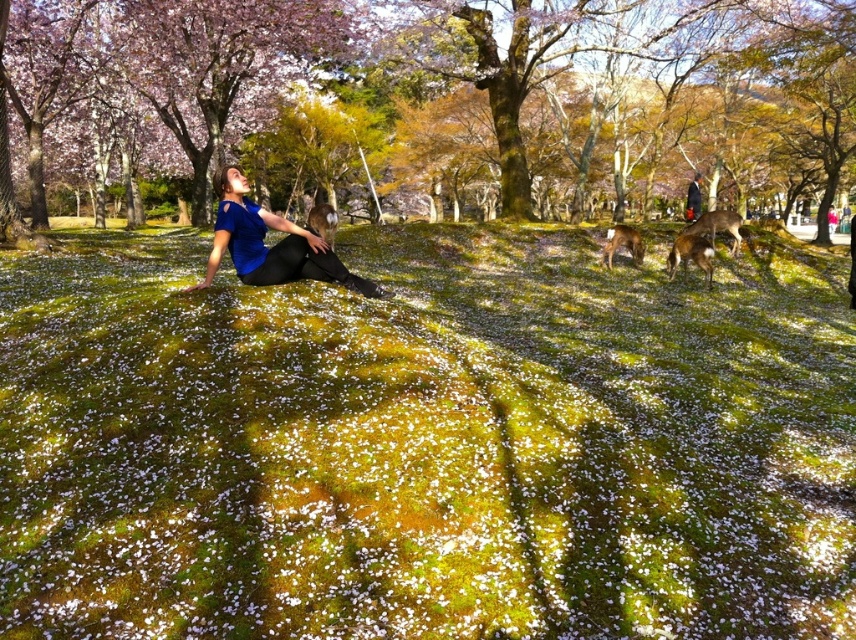
Question: Which point appears farthest from the camera in this image?

Choices:
 (A) (242, 244)
 (B) (684, 264)
 (C) (266, 410)
 (D) (694, 225)

Answer: (D)

Question: Among these objects, which one is farthest from the camera?

Choices:
 (A) white matte petals at center
 (B) brown furry deer at right

Answer: (B)

Question: Is blue matte shirt at center smaller than brown furry deer at right?

Choices:
 (A) no
 (B) yes

Answer: (A)

Question: Estimate the real-world distances between objects in this image. Which object is farther from the white matte petals at center?

Choices:
 (A) blue matte shirt at center
 (B) smooth bark tree at upper center
 (C) brown furry deer at right

Answer: (B)

Question: Does brown furry deer at center-right have a lesser width compared to brown furry deer at right?

Choices:
 (A) yes
 (B) no

Answer: (A)

Question: Does smooth bark tree at upper center appear on the right side of brown furry deer at center?

Choices:
 (A) yes
 (B) no

Answer: (B)